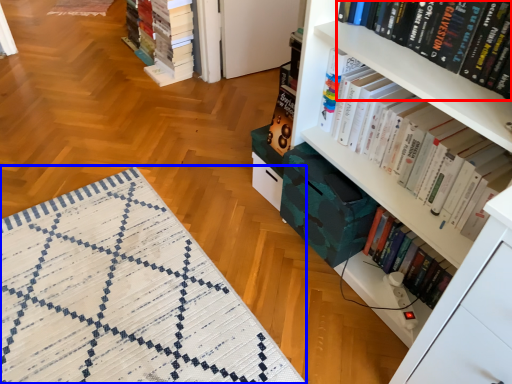
Question: Among these objects, which one is farthest to the camera, book (highlighted by a red box) or mat (highlighted by a blue box)?

Choices:
 (A) book
 (B) mat

Answer: (B)